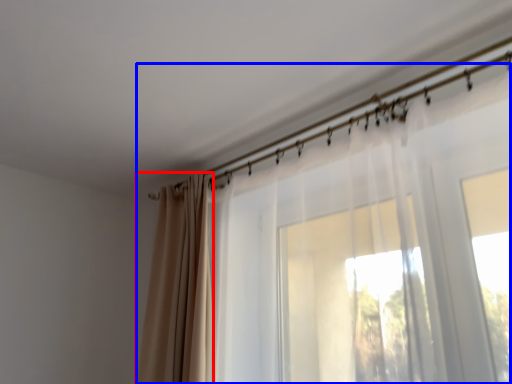
Question: Which object is closer to the camera taking this photo, curtain (highlighted by a red box) or curtain (highlighted by a blue box)?

Choices:
 (A) curtain
 (B) curtain

Answer: (B)